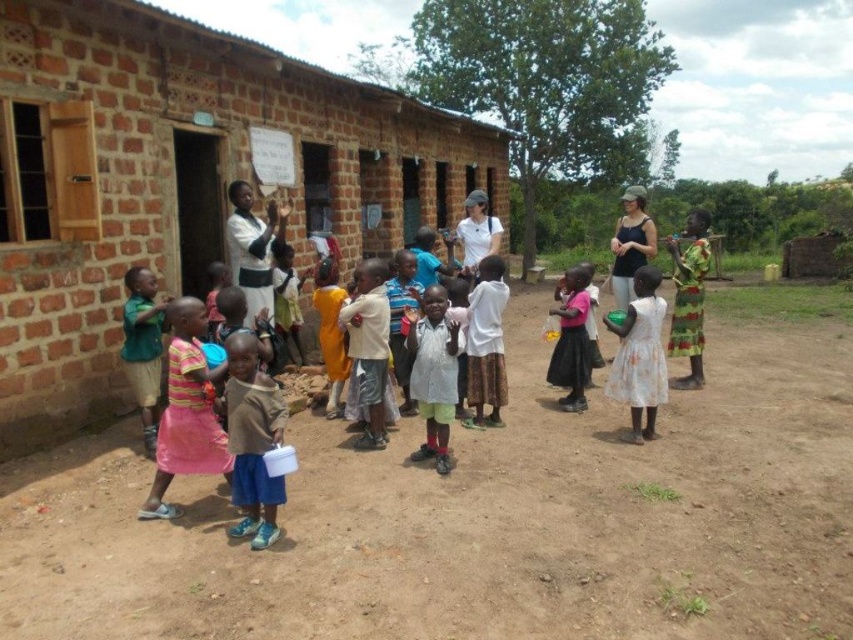
Consider the image. You are organizing a group photo and need to arrange the participants so that the white matte shirt at center and the pink fabric dress at center are visible. Given their sizes, which clothing item should be placed closer to the front to ensure both are visible?

The white matte shirt at center has a smaller width than the pink fabric dress at center. To ensure both are visible in the group photo, the white matte shirt at center should be placed closer to the front so that it doesn not get obscured by the wider pink fabric dress at center.

Based on the photo, you are standing in front of the brick building and want to walk to the white cotton shirt at center. Which direction should you move relative to the brown dirt field at center?

The brown dirt field at center is closer to the viewer than the white cotton shirt at center, so to reach the white cotton shirt at center, you should move away from the brown dirt field at center.